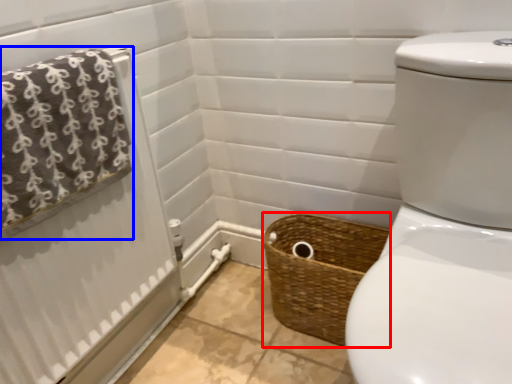
Question: Among these objects, which one is nearest to the camera, basket (highlighted by a red box) or bath towel (highlighted by a blue box)?

Choices:
 (A) basket
 (B) bath towel

Answer: (B)